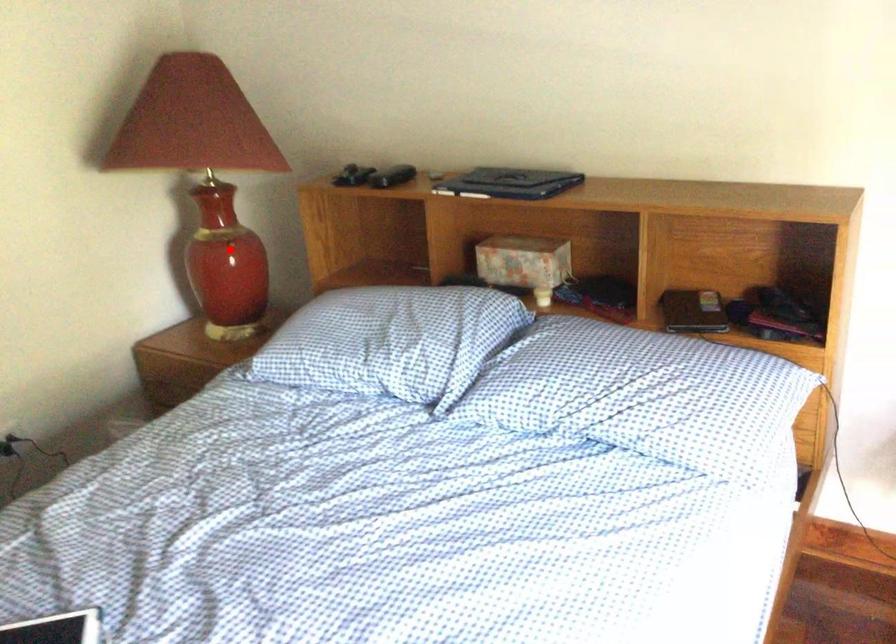
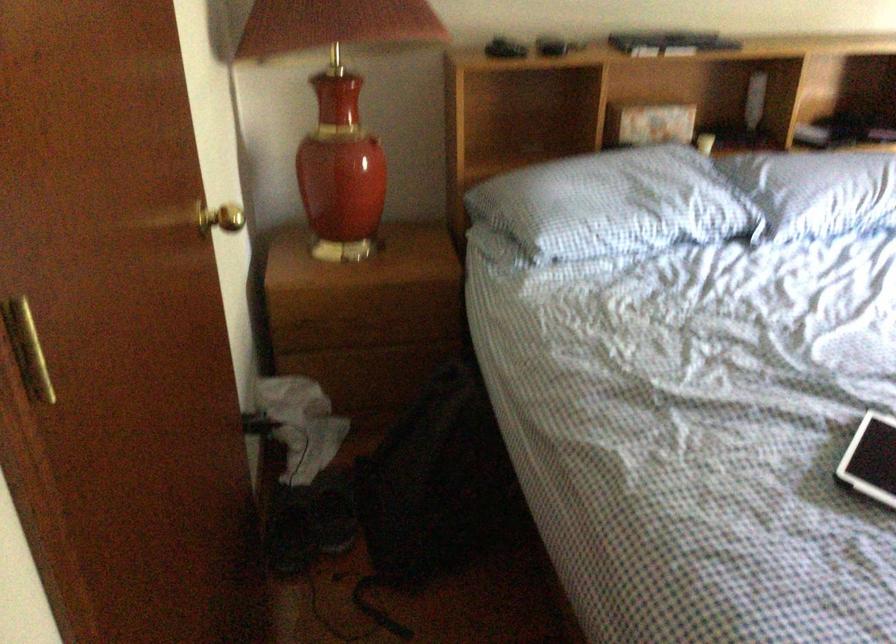
Question: I am providing you with two images of the same scene from different viewpoints. A red point is marked on the first image. Can you still see the location of the red point in image 2?

Choices:
 (A) Yes
 (B) No

Answer: (B)